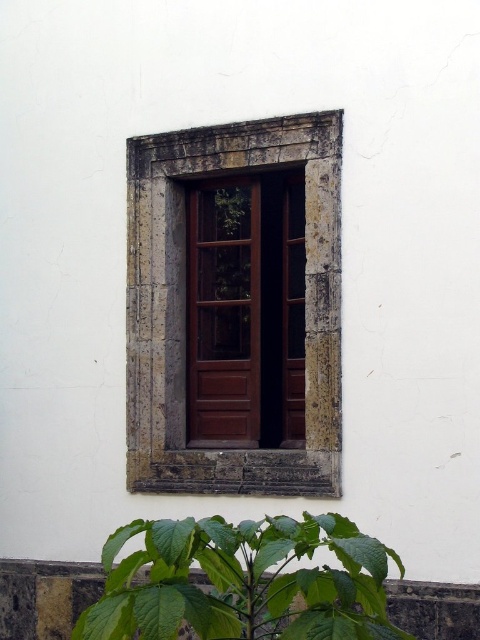
Question: Among these objects, which one is farthest from the camera?

Choices:
 (A) stone textured window frame at center
 (B) brown wooden door at center

Answer: (B)

Question: Does stone textured window frame at center have a greater width compared to brown wooden door at center?

Choices:
 (A) no
 (B) yes

Answer: (B)

Question: Where is green leafy plant at lower center located in relation to brown wooden door at center in the image?

Choices:
 (A) right
 (B) left

Answer: (A)

Question: Which of the following is the farthest from the observer?

Choices:
 (A) stone textured window frame at center
 (B) brown wooden door at center

Answer: (B)

Question: Based on their relative distances, which object is nearer to the brown wooden door at center?

Choices:
 (A) green leafy plant at lower center
 (B) stone textured window frame at center

Answer: (B)

Question: Is stone textured window frame at center below green leafy plant at lower center?

Choices:
 (A) no
 (B) yes

Answer: (A)